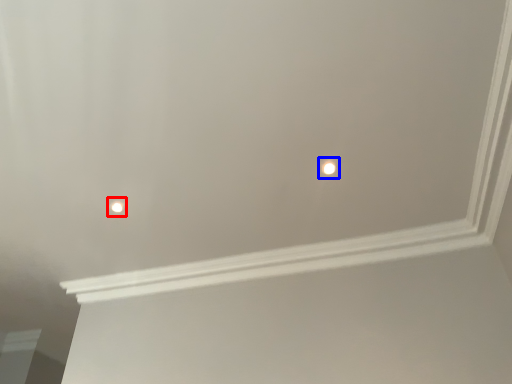
Question: Which of the following is the farthest to the observer, light (highlighted by a red box) or light (highlighted by a blue box)?

Choices:
 (A) light
 (B) light

Answer: (A)